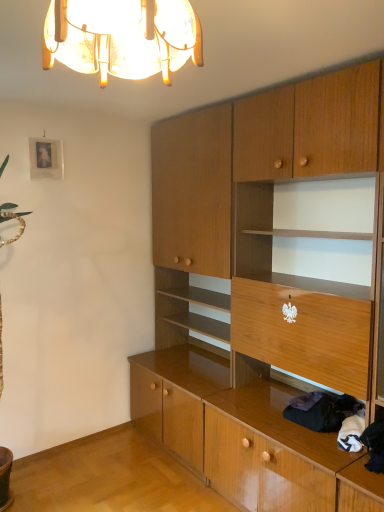
Question: From a real-world perspective, is translucent glass chandelier at upper center physically above wooden cabinet at center?

Choices:
 (A) yes
 (B) no

Answer: (A)

Question: Can you confirm if translucent glass chandelier at upper center is taller than wooden cabinet at center?

Choices:
 (A) yes
 (B) no

Answer: (B)

Question: Considering the relative sizes of translucent glass chandelier at upper center and wooden cabinet at center in the image provided, is translucent glass chandelier at upper center smaller than wooden cabinet at center?

Choices:
 (A) yes
 (B) no

Answer: (A)

Question: Does translucent glass chandelier at upper center contain wooden cabinet at center?

Choices:
 (A) yes
 (B) no

Answer: (B)

Question: From a real-world perspective, is translucent glass chandelier at upper center below wooden cabinet at center?

Choices:
 (A) no
 (B) yes

Answer: (A)

Question: From the image's perspective, relative to translucent glass chandelier at upper center, is wooden cabinet at center above or below?

Choices:
 (A) above
 (B) below

Answer: (B)

Question: Visually, is wooden cabinet at center positioned to the left or to the right of translucent glass chandelier at upper center?

Choices:
 (A) right
 (B) left

Answer: (A)

Question: Considering the positions of wooden cabinet at center and translucent glass chandelier at upper center in the image, is wooden cabinet at center wider or thinner than translucent glass chandelier at upper center?

Choices:
 (A) thin
 (B) wide

Answer: (B)

Question: Considering the positions of point (226, 467) and point (115, 40), is point (226, 467) closer or farther from the camera than point (115, 40)?

Choices:
 (A) farther
 (B) closer

Answer: (A)

Question: Looking at the image, does dark woolen sweater at lower right seem bigger or smaller compared to translucent glass chandelier at upper center?

Choices:
 (A) big
 (B) small

Answer: (B)

Question: Considering the relative positions of dark woolen sweater at lower right and translucent glass chandelier at upper center in the image provided, is dark woolen sweater at lower right to the left or to the right of translucent glass chandelier at upper center?

Choices:
 (A) right
 (B) left

Answer: (A)

Question: Choose the correct answer: Is dark woolen sweater at lower right inside translucent glass chandelier at upper center or outside it?

Choices:
 (A) inside
 (B) outside

Answer: (B)

Question: From a real-world perspective, is dark woolen sweater at lower right physically located above or below translucent glass chandelier at upper center?

Choices:
 (A) below
 (B) above

Answer: (A)

Question: Relative to dark woolen sweater at lower right, is wooden cabinet at center in front or behind?

Choices:
 (A) front
 (B) behind

Answer: (A)

Question: Is wooden cabinet at center bigger or smaller than dark woolen sweater at lower right?

Choices:
 (A) small
 (B) big

Answer: (B)